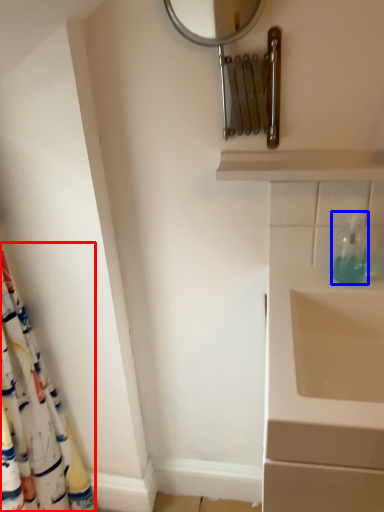
Question: Among these objects, which one is farthest to the camera, shower curtain (highlighted by a red box) or soap dispenser (highlighted by a blue box)?

Choices:
 (A) shower curtain
 (B) soap dispenser

Answer: (B)